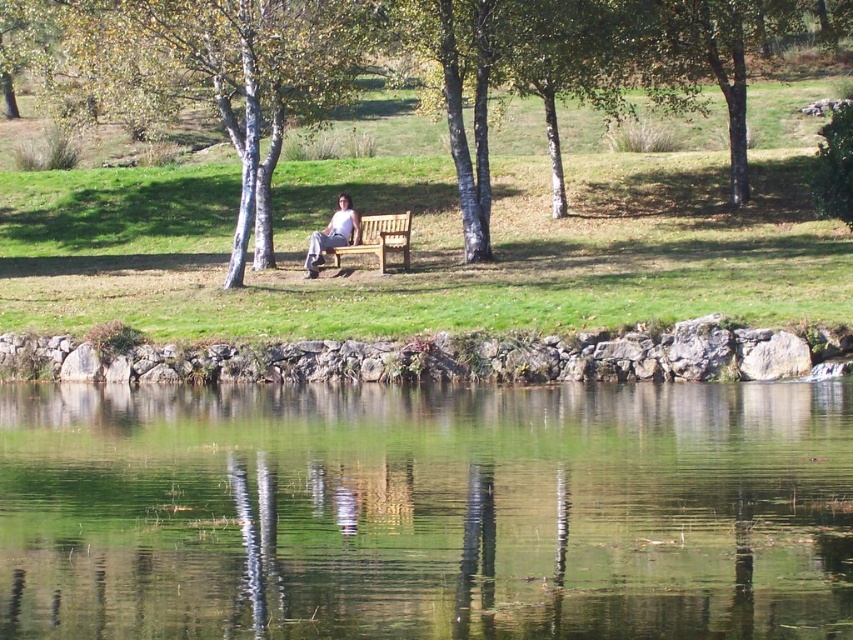
You are standing on the wooden bench and want to place a 10 meter long fishing rod between the green reflective water at center and the brown bark tree at center. Is it possible to do so without bending the rod?

The distance between the green reflective water at center and the brown bark tree at center is 9.02 meters. Since the fishing rod is 10 meters long, it would extend beyond the space between them, so it is not possible to place it without bending the rod.

You are standing at the edge of the water and want to walk to the point marked as point (259, 209). There is a point marked as point (83, 444) along the way. Which point will you encounter first?

You will encounter point (83, 444) first because it is closer to the viewer than point (259, 209).